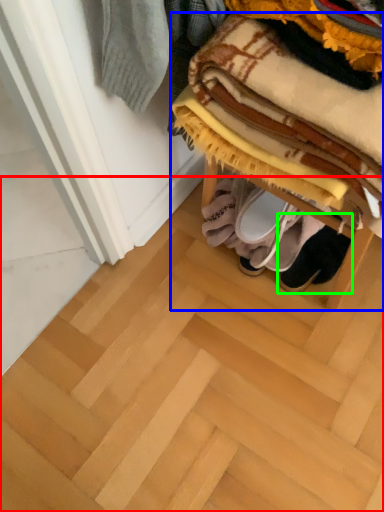
Question: Which object is positioned closest to stair (highlighted by a red box)? Select from furniture (highlighted by a blue box) and footwear (highlighted by a green box).

Choices:
 (A) furniture
 (B) footwear

Answer: (B)